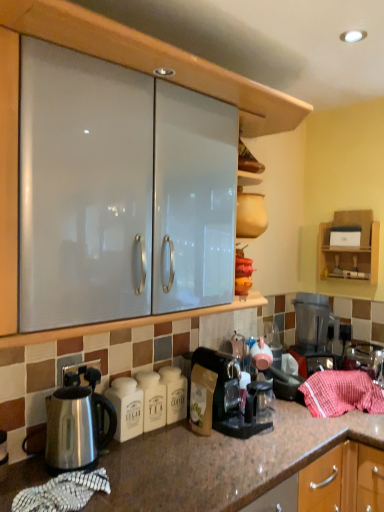
Question: Does transparent plastic coffee maker at lower center, the first coffee maker from the front, come behind white ceramic sugar container at lower left?

Choices:
 (A) yes
 (B) no

Answer: (A)

Question: Is transparent plastic coffee maker at lower center, which is the 2th coffee maker in back-to-front order, positioned beyond the bounds of white ceramic sugar container at lower left?

Choices:
 (A) no
 (B) yes

Answer: (B)

Question: Does transparent plastic coffee maker at lower center, which is the 1th coffee maker from left to right, turn towards white ceramic sugar container at lower left?

Choices:
 (A) yes
 (B) no

Answer: (B)

Question: Does transparent plastic coffee maker at lower center, the 2th coffee maker from the right, have a smaller size compared to white ceramic sugar container at lower left?

Choices:
 (A) yes
 (B) no

Answer: (B)

Question: Is transparent plastic coffee maker at lower center, the 2th coffee maker from the right, wider than white ceramic sugar container at lower left?

Choices:
 (A) yes
 (B) no

Answer: (A)

Question: From the image's perspective, is white ceramic sugar container at lower left located above or below transparent plastic coffee maker at lower center, the first coffee maker from the front?

Choices:
 (A) below
 (B) above

Answer: (A)

Question: Considering their positions, is white ceramic sugar container at lower left located in front of or behind transparent plastic coffee maker at lower center, which is the 1th coffee maker from left to right?

Choices:
 (A) front
 (B) behind

Answer: (A)

Question: From a real-world perspective, relative to transparent plastic coffee maker at lower center, the 2th coffee maker from the right, is white ceramic sugar container at lower left vertically above or below?

Choices:
 (A) above
 (B) below

Answer: (B)

Question: Considering the positions of white ceramic sugar container at lower left and transparent plastic coffee maker at lower center, the 2th coffee maker from the right, in the image, is white ceramic sugar container at lower left taller or shorter than transparent plastic coffee maker at lower center, the 2th coffee maker from the right,?

Choices:
 (A) tall
 (B) short

Answer: (B)

Question: Considering the positions of black plastic coffee maker at right, which is the first coffee maker in back-to-front order, and stainless steel kettle at lower left in the image, is black plastic coffee maker at right, which is the first coffee maker in back-to-front order, bigger or smaller than stainless steel kettle at lower left?

Choices:
 (A) big
 (B) small

Answer: (A)

Question: Does point (301, 328) appear closer or farther from the camera than point (77, 377)?

Choices:
 (A) closer
 (B) farther

Answer: (B)

Question: Considering the relative positions of black plastic coffee maker at right, which is the first coffee maker in back-to-front order, and stainless steel kettle at lower left in the image provided, is black plastic coffee maker at right, which is the first coffee maker in back-to-front order, to the left or to the right of stainless steel kettle at lower left?

Choices:
 (A) right
 (B) left

Answer: (A)

Question: Which is correct: black plastic coffee maker at right, which is the first coffee maker in back-to-front order, is inside stainless steel kettle at lower left, or outside of it?

Choices:
 (A) inside
 (B) outside

Answer: (B)

Question: Considering the positions of point (326, 385) and point (134, 410), is point (326, 385) closer or farther from the camera than point (134, 410)?

Choices:
 (A) closer
 (B) farther

Answer: (B)

Question: Is red striped cloth at lower right bigger or smaller than white ceramic sugar container at lower left?

Choices:
 (A) small
 (B) big

Answer: (B)